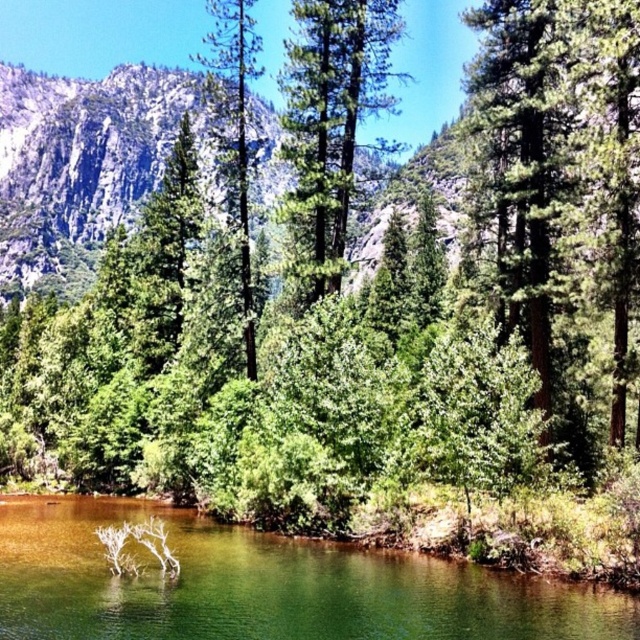
You are a bird flying over the serene natural landscape. You need to land on the higher object between the green glossy water at center and the green matte tree at center. Which one should you choose?

The green matte tree at center is taller than the green glossy water at center, so you should land on the green matte tree at center.

You are standing at the edge of the water in the serene natural landscape. You want to reach the green glossy water at center located at point [268,586]. Is the path from your current position to that point clear of any obstacles?

The path to the green glossy water at center located at point [268,586] is clear of obstacles as there are no objects mentioned in the scene description blocking the way.

You are a bird flying over the serene natural landscape. You need to land on a surface. Which object between the green glossy water at center and the green textured pine tree at center is shorter in height for a safe landing?

The green glossy water at center has a lesser height compared to the green textured pine tree at center, so it is shorter and safer for landing.